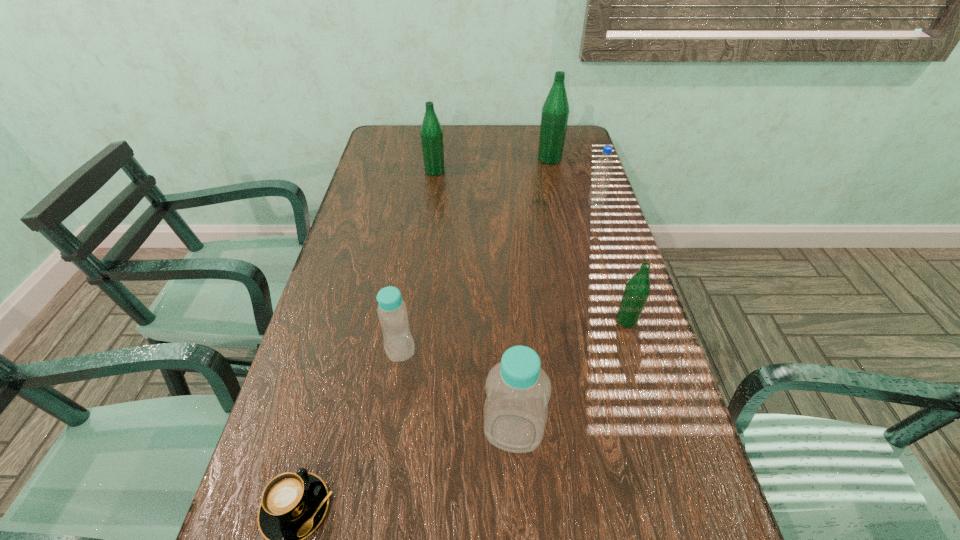
Identify which object is located as the third nearest to the fourth object from right to left. Please provide its 2D coordinates. Your answer should be formatted as a tuple, i.e. [(x, y)], where the tuple contains the x and y coordinates of a point satisfying the conditions above.

[(637, 289)]

This screenshot has height=540, width=960. In order to click on the third closest bottle relative to the smallest green bottle in this screenshot , I will do `click(555, 112)`.

Select which bottle appears as the second closest to the third nearest object. Please provide its 2D coordinates. Your answer should be formatted as a tuple, i.e. [(x, y)], where the tuple contains the x and y coordinates of a point satisfying the conditions above.

[(637, 289)]

Point out which green bottle is positioned as the second nearest to the smaller blue bottle. Please provide its 2D coordinates. Your answer should be formatted as a tuple, i.e. [(x, y)], where the tuple contains the x and y coordinates of a point satisfying the conditions above.

[(431, 132)]

In order to click on green bottle that is the third closest to the water bottle in this screenshot , I will do `click(431, 132)`.

Locate an element on the screen. The height and width of the screenshot is (540, 960). free location that satisfies the following two spatial constraints: 1. on the back side of the left blue bottle; 2. on the right side of the fifth nearest object is located at coordinates (422, 205).